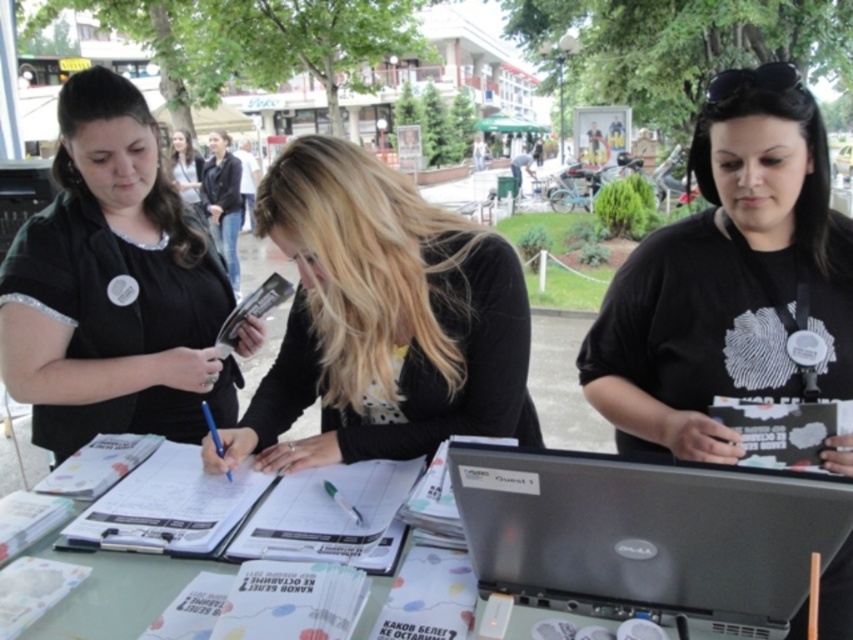
Question: Among these objects, which one is nearest to the camera?

Choices:
 (A) black dotted shirt at center
 (B) black matte shirt at center
 (C) matte black shirt at left
 (D) clear glass table at center

Answer: (D)

Question: Which of the following is the closest to the observer?

Choices:
 (A) (679, 477)
 (B) (270, 449)
 (C) (42, 416)

Answer: (A)

Question: Is black matte shirt at center in front of clear glass table at center?

Choices:
 (A) no
 (B) yes

Answer: (A)

Question: From the image, what is the correct spatial relationship of black matte shirt at center in relation to matte black shirt at center?

Choices:
 (A) above
 (B) below

Answer: (B)

Question: Can you confirm if black matte shirt at center is positioned above black dotted shirt at center?

Choices:
 (A) no
 (B) yes

Answer: (A)

Question: Which object is the closest to the black matte shirt at center?

Choices:
 (A) matte black shirt at center
 (B) clear glass table at center
 (C) black dotted shirt at center
 (D) matte black shirt at left

Answer: (C)